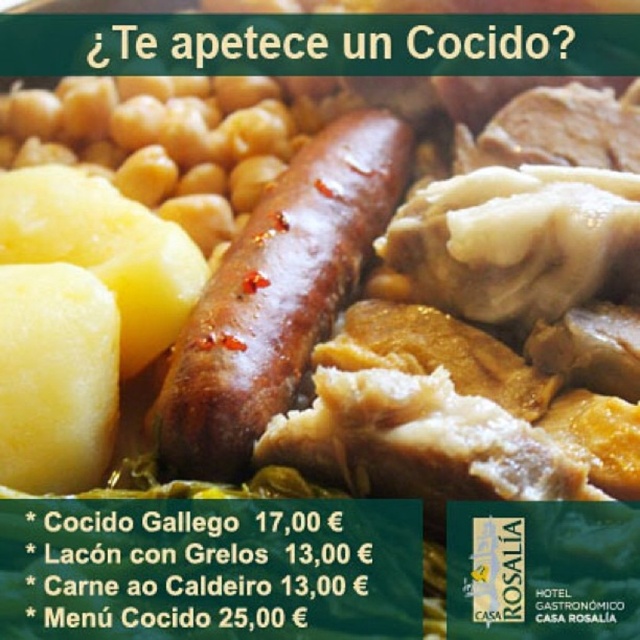
Can you confirm if yellow smooth potato at left is bigger than yellow matte potato at lower left?

Correct, yellow smooth potato at left is larger in size than yellow matte potato at lower left.

Does yellow smooth potato at left appear over yellow matte potato at lower left?

Yes, yellow smooth potato at left is above yellow matte potato at lower left.

Who is more distant from viewer, [74,364] or [61,460]?

The point [74,364] is behind.

Where is `yellow smooth potato at left`? yellow smooth potato at left is located at coordinates (77, 317).

Find the location of a particular element. This screenshot has width=640, height=640. brown matte sausage at center is located at coordinates (276, 296).

Is point (394, 141) closer to camera compared to point (93, 465)?

No, (394, 141) is behind (93, 465).

Identify the location of brown matte sausage at center. (276, 296).

Can you confirm if yellow smooth potato at left is positioned to the right of brown matte sausage at center?

Incorrect, yellow smooth potato at left is not on the right side of brown matte sausage at center.

In order to click on yellow smooth potato at left in this screenshot , I will do `click(77, 317)`.

The height and width of the screenshot is (640, 640). In order to click on yellow smooth potato at left in this screenshot , I will do `click(77, 317)`.